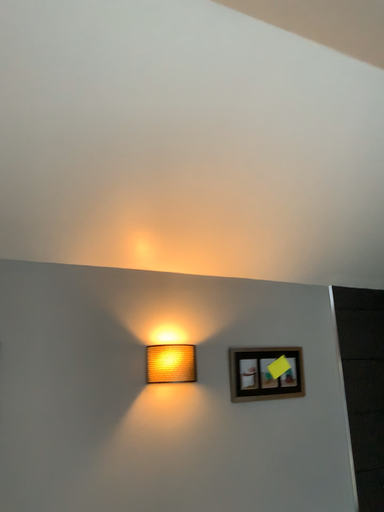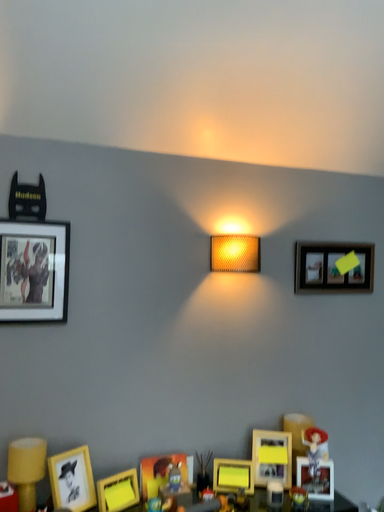
Question: How did the camera likely rotate when shooting the video?

Choices:
 (A) rotated right
 (B) rotated left

Answer: (B)